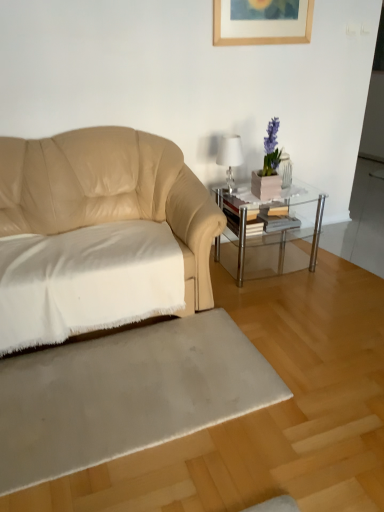
Question: From the image's perspective, is clear glass table at center located above or below white glossy table lamp at upper right?

Choices:
 (A) below
 (B) above

Answer: (A)

Question: Is clear glass table at center in front of or behind white glossy table lamp at upper right in the image?

Choices:
 (A) behind
 (B) front

Answer: (B)

Question: Based on their relative distances, which object is nearer to the white soft fabric at left?

Choices:
 (A) silky beige rug at lower center
 (B) white glossy table lamp at upper right
 (C) clear glass table at center

Answer: (A)

Question: Which is nearer to the silky beige rug at lower center?

Choices:
 (A) clear glass table at center
 (B) white soft fabric at left
 (C) white glossy table lamp at upper right

Answer: (B)